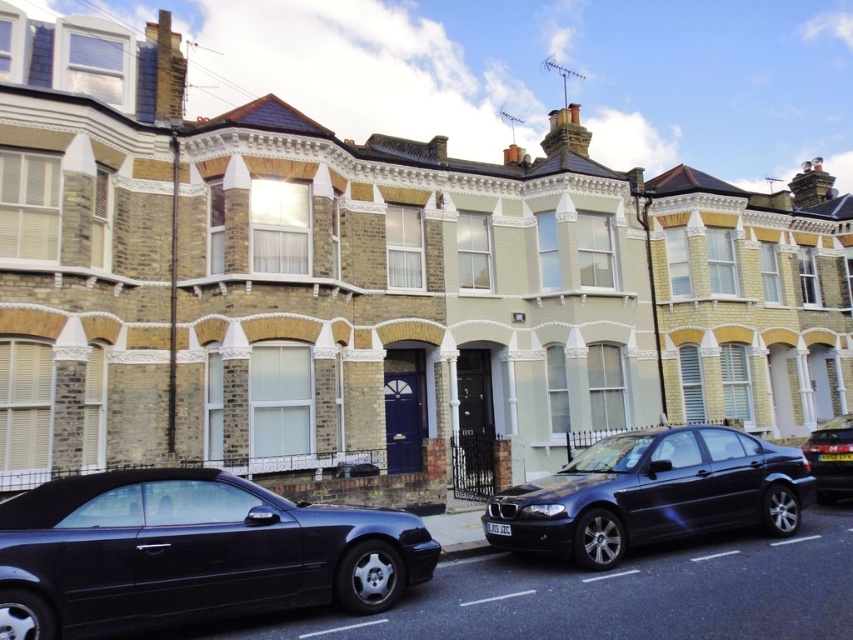
Question: Which object is the closest to the glossy black sedan at center?

Choices:
 (A) shiny black convertible at lower left
 (B) shiny black sedan at center

Answer: (A)

Question: Can you confirm if glossy black sedan at center is thinner than shiny black sedan at center?

Choices:
 (A) no
 (B) yes

Answer: (A)

Question: Can you confirm if glossy black sedan at center is smaller than shiny black sedan at center?

Choices:
 (A) no
 (B) yes

Answer: (A)

Question: Which object appears closest to the camera in this image?

Choices:
 (A) shiny black sedan at center
 (B) shiny black convertible at lower left

Answer: (B)

Question: In this image, where is shiny black convertible at lower left located relative to shiny black sedan at center?

Choices:
 (A) right
 (B) left

Answer: (B)

Question: Which of these objects is positioned farthest from the shiny black sedan at center?

Choices:
 (A) shiny black convertible at lower left
 (B) glossy black sedan at center

Answer: (A)